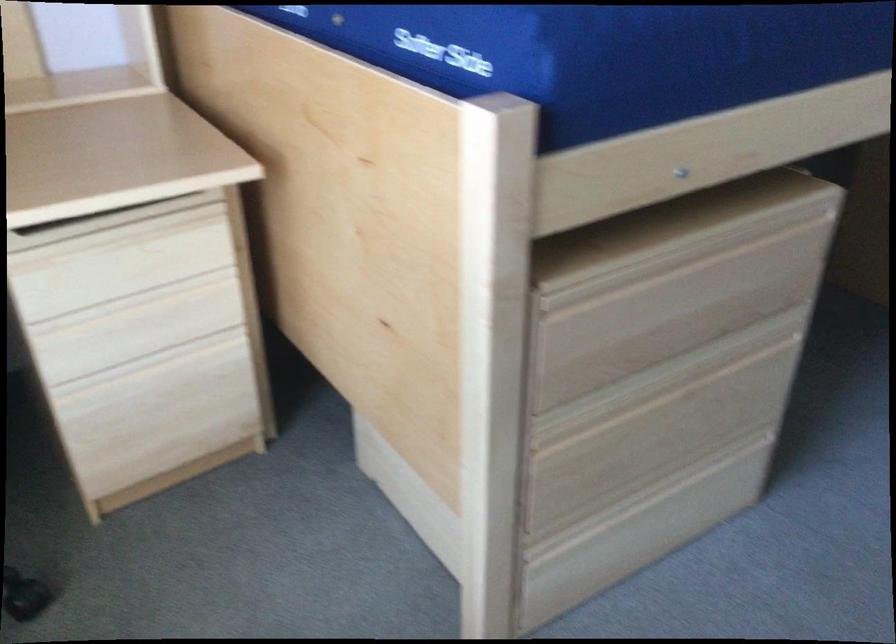
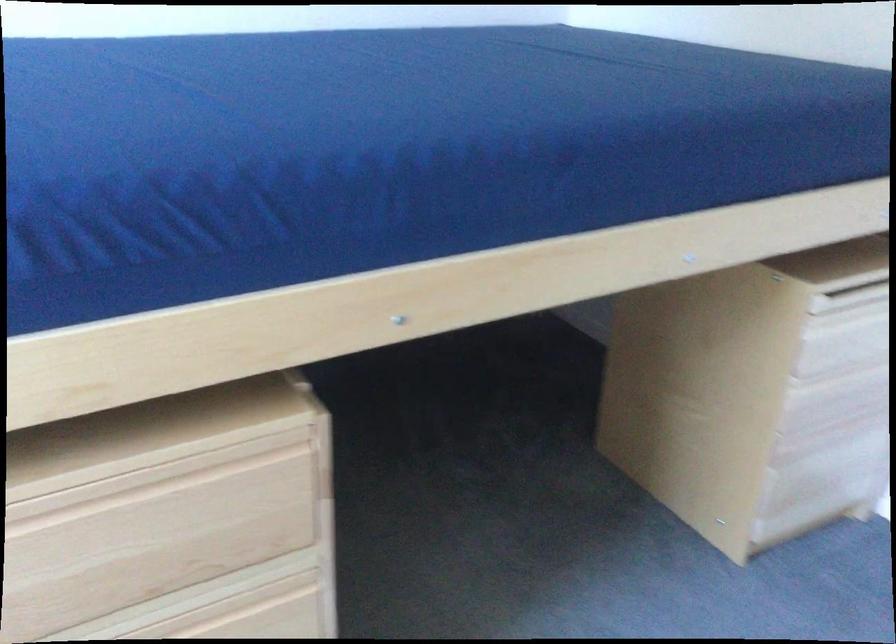
In the second image, find the point that corresponds to (x=746, y=363) in the first image.

(253, 614)